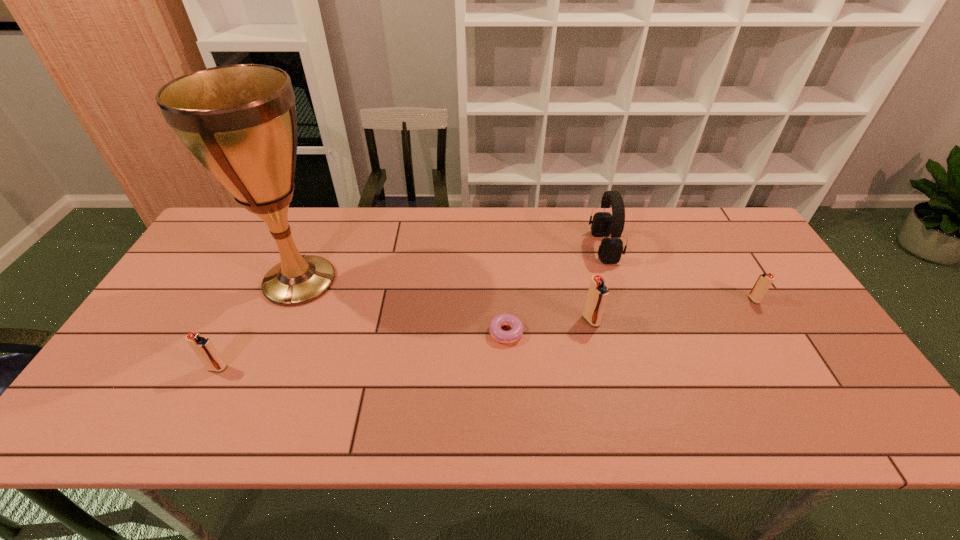
You are a GUI agent. You are given a task and a screenshot of the screen. Output one action in this format:
    pyautogui.click(x=<x>, y=<y>)
    Task: Click on the vacant spot for a new igniter to ensure equal spacing
    The width and height of the screenshot is (960, 540).
    Given the screenshot: What is the action you would take?
    pyautogui.click(x=413, y=343)